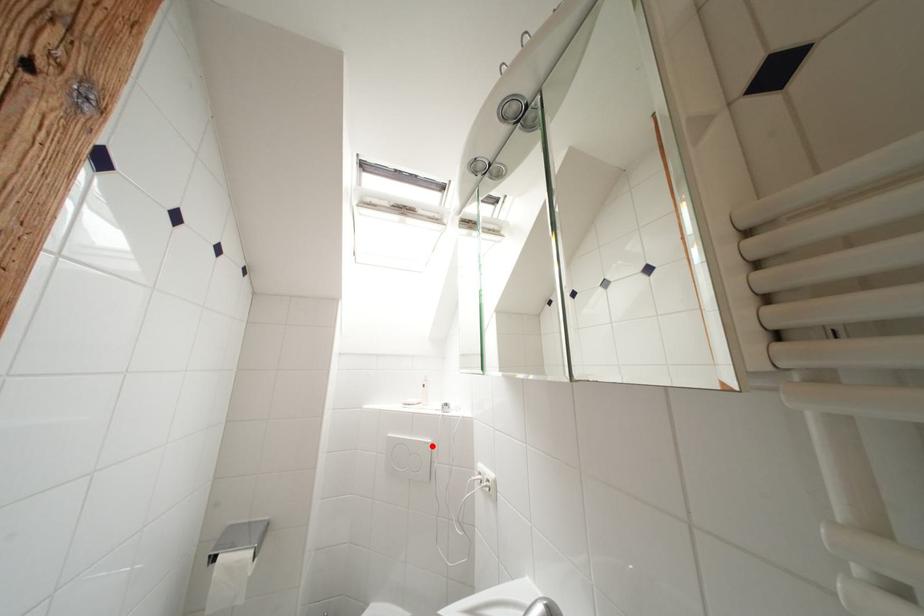
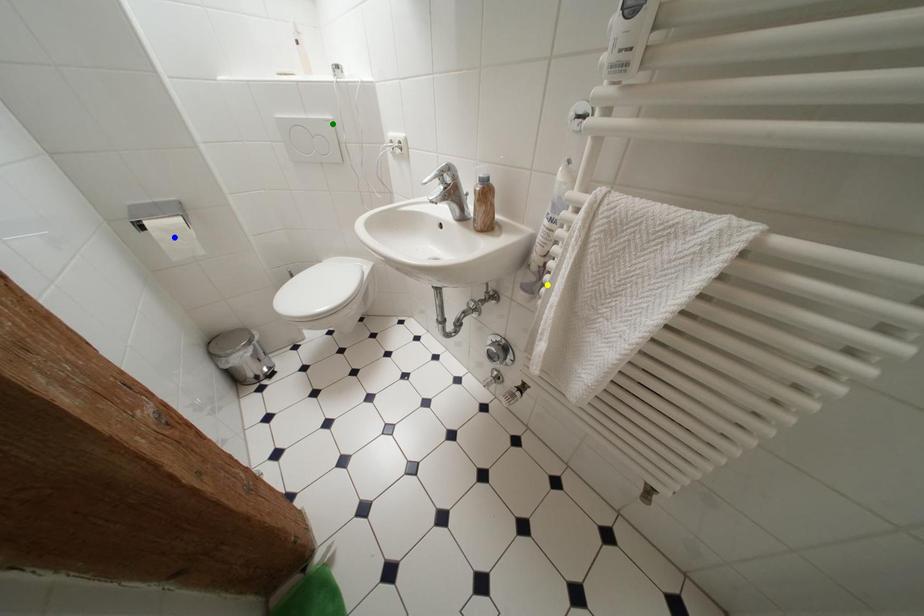
Question: I am providing you with two images of the same scene from different viewpoints. A red point is marked on the first image. You are given multiple points on the second image. In image 2, which mark is for the same physical point as the one in image 1?

Choices:
 (A) green point
 (B) yellow point
 (C) blue point

Answer: (A)